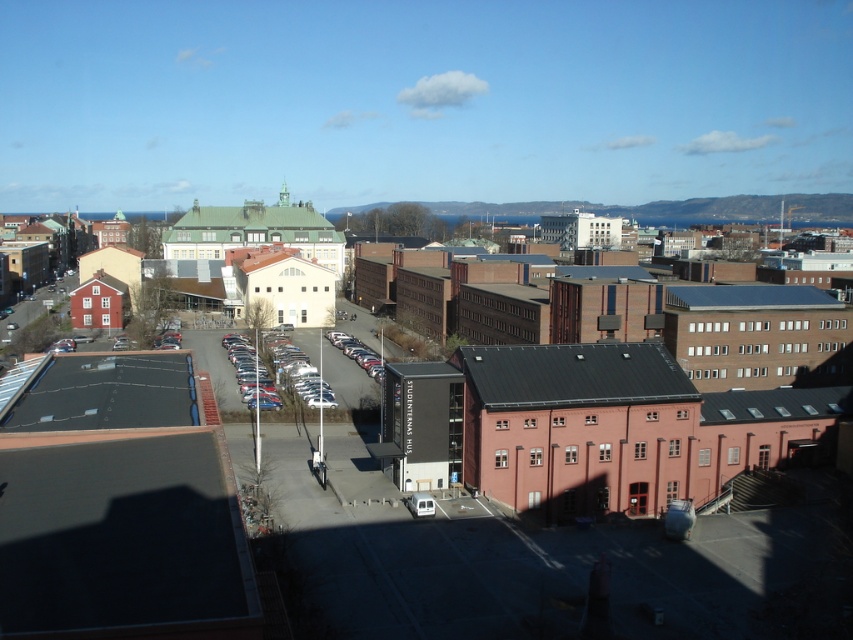
You are a delivery driver who needs to park your metallic silver car at center in a spot that can accommodate its height. The parking spot near the brick building at center has a height restriction of 2 meters. Can your car safely park there?

The brick building at center is taller than the metallic silver car at center, but the height restriction is 2 meters. Without knowing the exact height of the car, it is impossible to determine if it can park safely. Please check the car manufacturer specifications for its height.

You are a pedestrian standing at the edge of the parking lot. You want to walk to the entrance of STUDENTERNAS HUS building. Which object, the brick building at center or the metallic silver car at center, is closer to you as you start your path?

The brick building at center is closer to you because it is in front of the metallic silver car at center, meaning it is positioned nearer to your starting point at the parking lot edge.